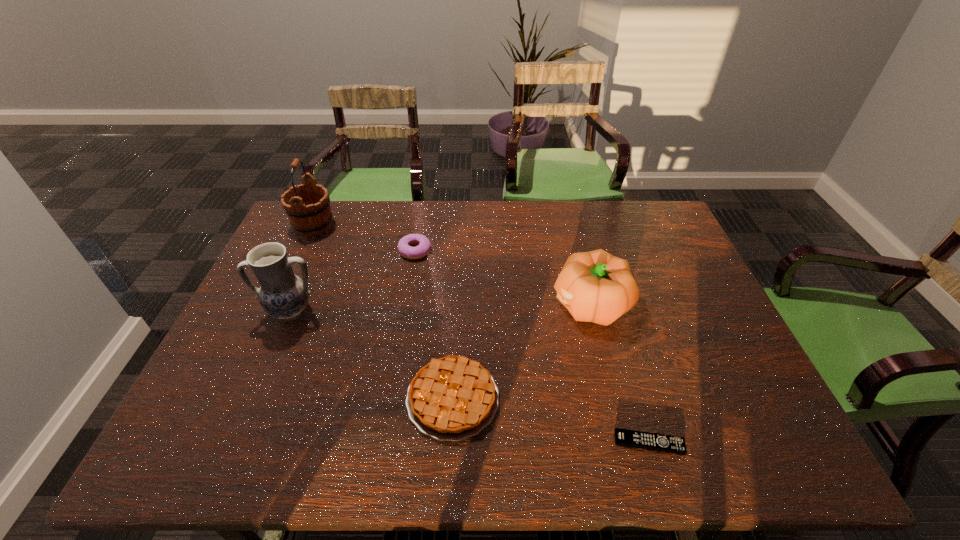
At what (x,y) coordinates should I click in order to perform the action: click on object located in the far left corner section of the desktop. Please return your answer as a coordinate pair (x, y). The image size is (960, 540). Looking at the image, I should click on (309, 216).

Image resolution: width=960 pixels, height=540 pixels. What are the coordinates of `free point at the far edge` in the screenshot? It's located at 525,227.

The width and height of the screenshot is (960, 540). What are the coordinates of `vacant space at the near edge` in the screenshot? It's located at (x=287, y=447).

I want to click on vacant region at the left edge of the desktop, so click(x=272, y=362).

The width and height of the screenshot is (960, 540). Identify the location of free space at the right edge. (690, 272).

Locate an element on the screen. vacant space at the near left corner of the desktop is located at coordinates (212, 450).

Find the location of `vacant space at the far right corner`. vacant space at the far right corner is located at coordinates (621, 206).

This screenshot has height=540, width=960. Identify the location of free space between the wine bucket and the third tallest object. click(452, 265).

Where is `unoccupied position between the pie and the pumpkin`? The image size is (960, 540). unoccupied position between the pie and the pumpkin is located at coordinates (521, 352).

Where is `free area in between the doughnut and the pie`? This screenshot has width=960, height=540. free area in between the doughnut and the pie is located at coordinates (434, 325).